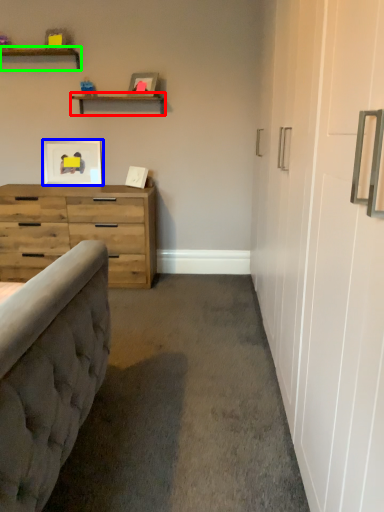
Question: Which object is positioned closest to shelf (highlighted by a red box)? Select from picture frame (highlighted by a blue box) and shelf (highlighted by a green box).

Choices:
 (A) picture frame
 (B) shelf

Answer: (B)